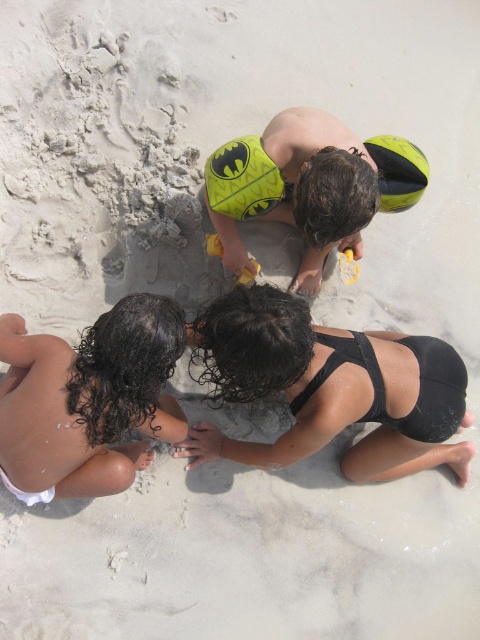
Question: Can you confirm if curly hair at lower left is positioned above yellow rubber duck at center?

Choices:
 (A) yes
 (B) no

Answer: (B)

Question: Does yellow matte swimsuit at center have a larger size compared to yellow rubber ball at center?

Choices:
 (A) no
 (B) yes

Answer: (B)

Question: Which object is farther from the camera taking this photo?

Choices:
 (A) yellow rubber duck at center
 (B) yellow rubber ball at center
 (C) yellow matte swimsuit at center
 (D) black matte swimsuit at center

Answer: (A)

Question: Is curly hair at lower left thinner than yellow plastic shovel at center?

Choices:
 (A) no
 (B) yes

Answer: (A)

Question: Which point is farther to the camera?

Choices:
 (A) yellow plastic shovel at center
 (B) yellow matte swimsuit at center

Answer: (A)

Question: Which point is farther from the camera taking this photo?

Choices:
 (A) (324, 118)
 (B) (204, 456)

Answer: (B)